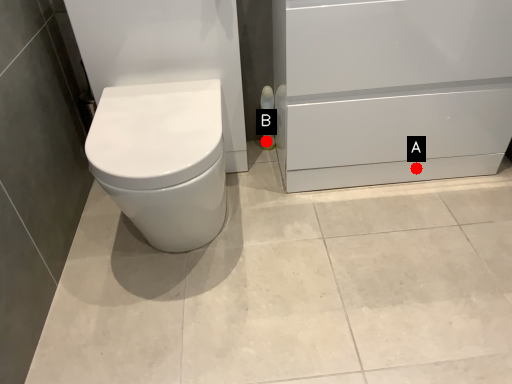
Question: Two points are circled on the image, labeled by A and B beside each circle. Which of the following is the farthest from the observer?

Choices:
 (A) A is further
 (B) B is further

Answer: (B)